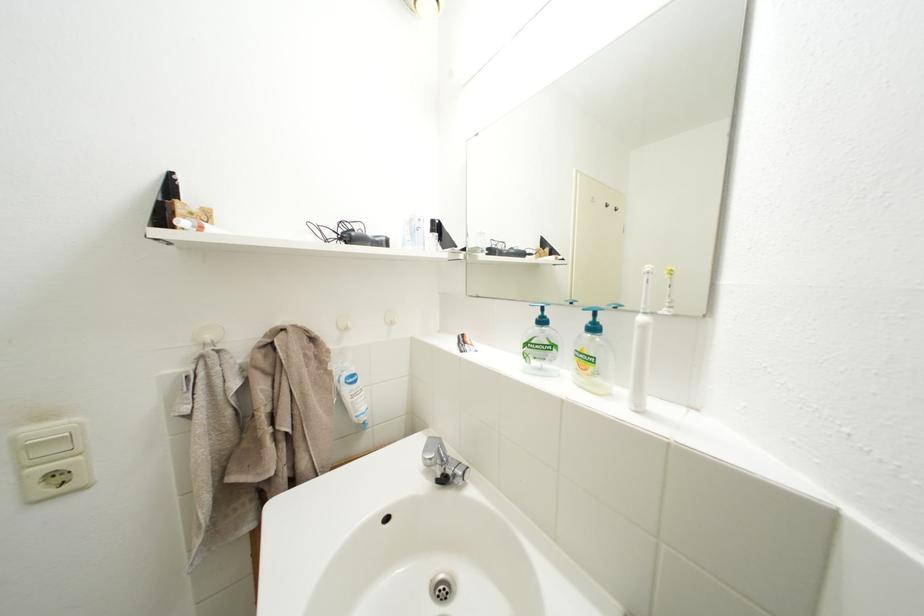
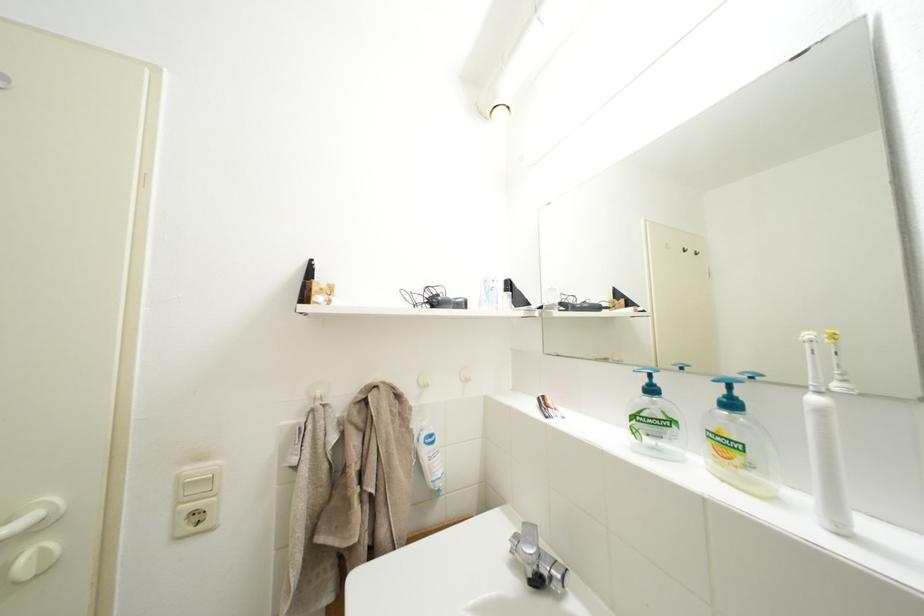
Find the pixel in the second image that matches (x=418, y=244) in the first image.

(493, 302)